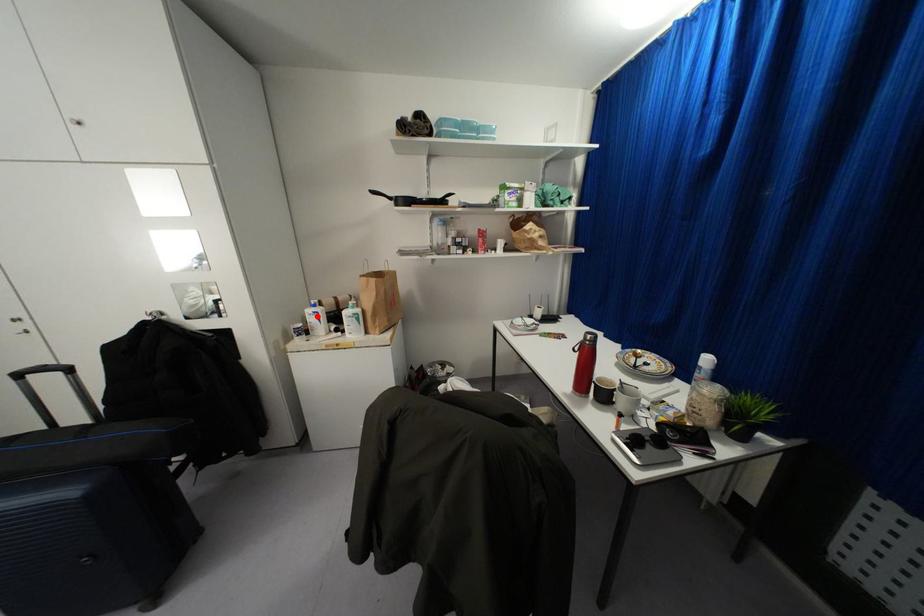
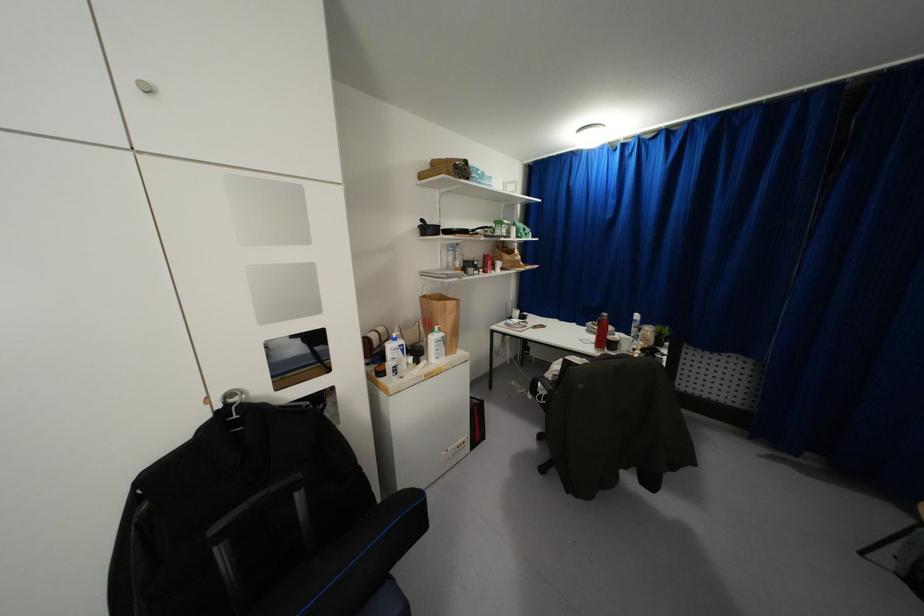
Question: I am providing you with two images of the same scene from different viewpoints. Given a red point in image1, look at the same physical point in image2. Is it:

Choices:
 (A) Closer to the viewpoint
 (B) Farther from the viewpoint

Answer: (A)